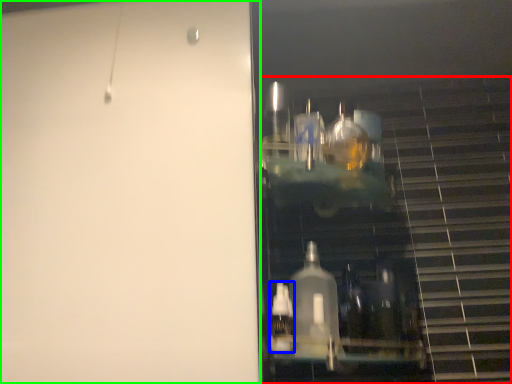
Question: Based on their relative distances, which object is farther from stairwell (highlighted by a red box)? Choose from bottle (highlighted by a blue box) and door (highlighted by a green box).

Choices:
 (A) bottle
 (B) door

Answer: (B)